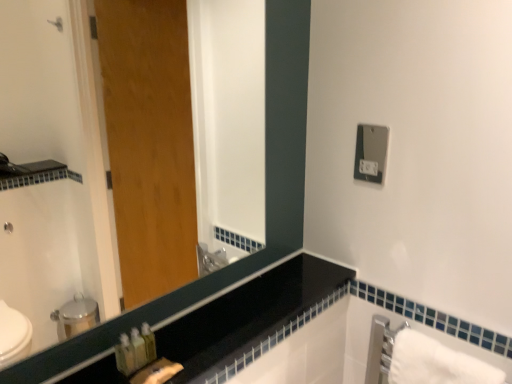
Find the location of a particular element. The height and width of the screenshot is (384, 512). free spot below black glass mirror at upper left (from a real-world perspective) is located at coordinates (x=156, y=338).